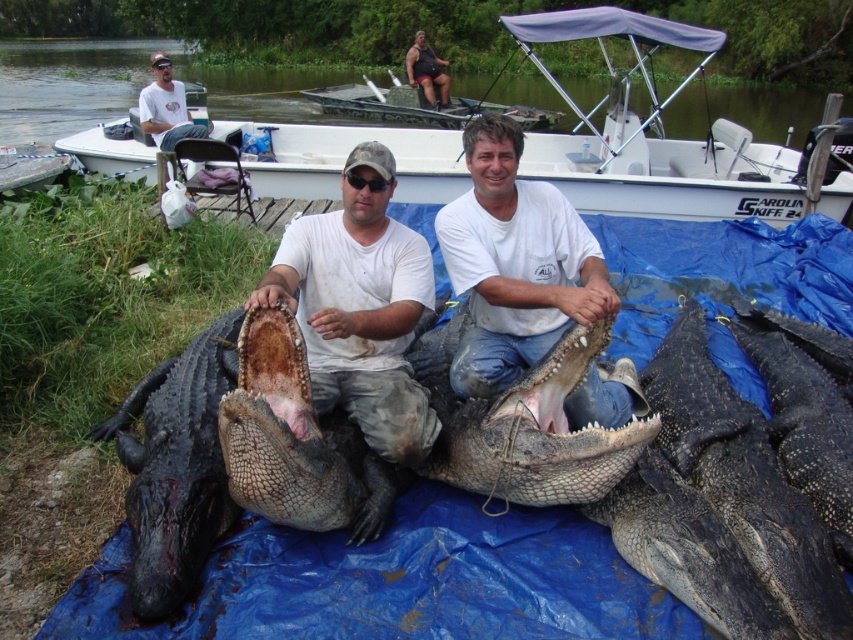
Can you confirm if matte white shirt at center is shorter than rough textured alligator at center?

In fact, matte white shirt at center may be taller than rough textured alligator at center.

Who is more forward, (407, 284) or (515, 291)?

Positioned in front is point (515, 291).

Which is behind, point (334, 336) or point (598, 296)?

Positioned behind is point (334, 336).

The height and width of the screenshot is (640, 853). I want to click on matte white shirt at center, so click(x=360, y=307).

Can you confirm if white plastic boat at upper center is taller than white t-shirt at upper left?

Incorrect, white plastic boat at upper center's height is not larger of white t-shirt at upper left's.

You are a GUI agent. You are given a task and a screenshot of the screen. Output one action in this format:
    pyautogui.click(x=<x>, y=<y>)
    Task: Click on the white plastic boat at upper center
    This screenshot has width=853, height=640.
    Given the screenshot: What is the action you would take?
    pyautogui.click(x=666, y=138)

Between shiny black crocodile at center and white t-shirt at upper left, which one is positioned lower?

Positioned lower is shiny black crocodile at center.

Is point (758, 592) closer to camera compared to point (140, 124)?

That is True.

At what (x,y) coordinates should I click in order to perform the action: click on shiny black crocodile at center. Please return your answer as a coordinate pair (x, y). Image resolution: width=853 pixels, height=640 pixels. Looking at the image, I should click on (598, 481).